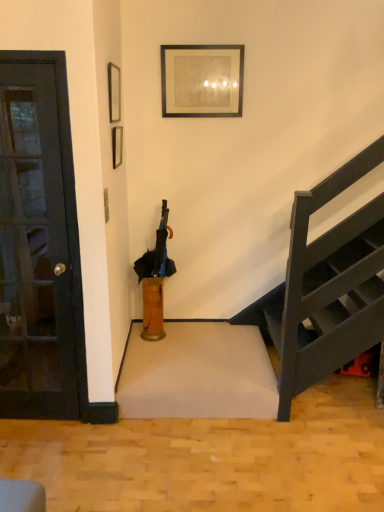
Question: Does matte black picture frame at upper left, marked as the first picture frame in a left-to-right arrangement, have a lesser width compared to translucent glass vase at center?

Choices:
 (A) yes
 (B) no

Answer: (A)

Question: Is matte black picture frame at upper left, the second picture frame viewed from the right, positioned before translucent glass vase at center?

Choices:
 (A) yes
 (B) no

Answer: (A)

Question: Is matte black picture frame at upper left, marked as the first picture frame in a left-to-right arrangement, further to the viewer compared to translucent glass vase at center?

Choices:
 (A) no
 (B) yes

Answer: (A)

Question: From the image's perspective, does matte black picture frame at upper left, which appears as the second picture frame when viewed from the back, appear lower than translucent glass vase at center?

Choices:
 (A) yes
 (B) no

Answer: (B)

Question: Considering the relative sizes of matte black picture frame at upper left, the second picture frame viewed from the right, and translucent glass vase at center in the image provided, is matte black picture frame at upper left, the second picture frame viewed from the right, bigger than translucent glass vase at center?

Choices:
 (A) no
 (B) yes

Answer: (A)

Question: Considering the relative positions of matte black picture frame at upper left, marked as the first picture frame in a left-to-right arrangement, and translucent glass vase at center in the image provided, is matte black picture frame at upper left, marked as the first picture frame in a left-to-right arrangement, to the right of translucent glass vase at center from the viewer's perspective?

Choices:
 (A) no
 (B) yes

Answer: (A)

Question: Is black matte umbrella at center at the back of black matte picture frame at upper center, the first picture frame positioned from the back?

Choices:
 (A) no
 (B) yes

Answer: (A)

Question: Does black matte picture frame at upper center, which appears as the first picture frame when viewed from the right, have a greater width compared to black matte umbrella at center?

Choices:
 (A) no
 (B) yes

Answer: (A)

Question: Considering the relative sizes of black matte picture frame at upper center, the second picture frame positioned from the left, and black matte umbrella at center in the image provided, is black matte picture frame at upper center, the second picture frame positioned from the left, thinner than black matte umbrella at center?

Choices:
 (A) no
 (B) yes

Answer: (B)

Question: Is black matte picture frame at upper center, which is the second picture frame from front to back, to the right of black matte umbrella at center from the viewer's perspective?

Choices:
 (A) yes
 (B) no

Answer: (A)

Question: Does black matte picture frame at upper center, the first picture frame positioned from the back, appear on the left side of black matte umbrella at center?

Choices:
 (A) yes
 (B) no

Answer: (B)

Question: From a real-world perspective, is black matte picture frame at upper center, which appears as the first picture frame when viewed from the right, below black matte umbrella at center?

Choices:
 (A) yes
 (B) no

Answer: (B)

Question: Would you say black glass door at left contains black matte picture frame at upper center, which appears as the first picture frame when viewed from the right?

Choices:
 (A) no
 (B) yes

Answer: (A)